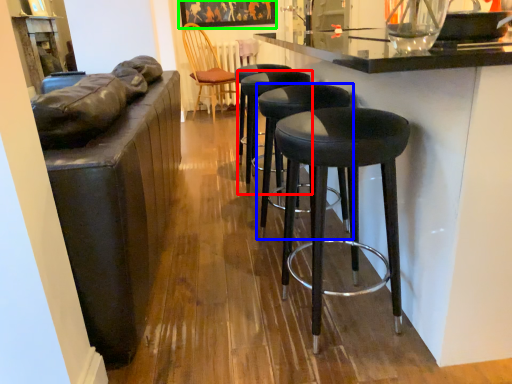
Question: Based on their relative distances, which object is farther from stool (highlighted by a red box)? Choose from stool (highlighted by a blue box) and picture frame (highlighted by a green box).

Choices:
 (A) stool
 (B) picture frame

Answer: (B)